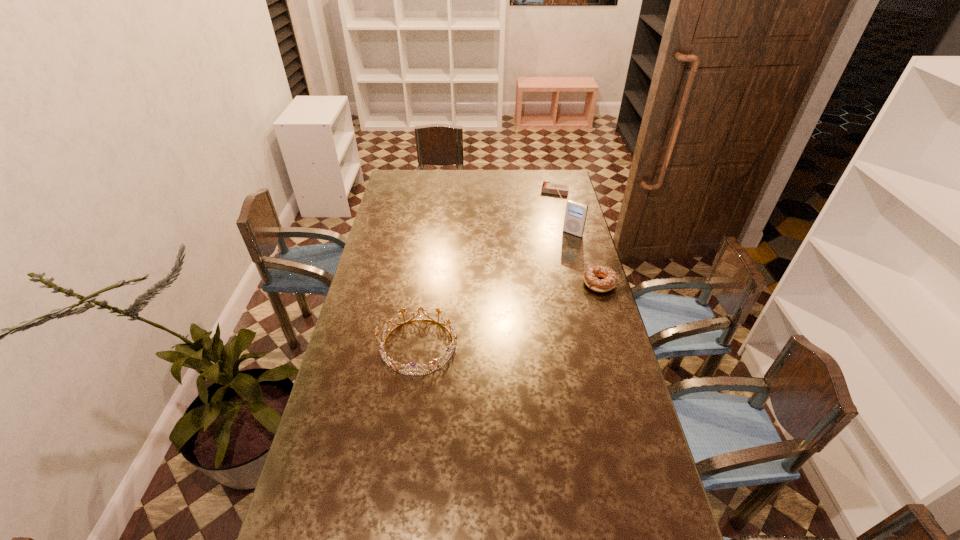
Where is `iPod that is at the right edge`? The width and height of the screenshot is (960, 540). iPod that is at the right edge is located at coordinates (575, 215).

Identify the location of matchbox situated at the right edge. (547, 187).

You are a GUI agent. You are given a task and a screenshot of the screen. Output one action in this format:
    pyautogui.click(x=<x>, y=<y>)
    Task: Click on the object that is positioned at the far right corner
    This screenshot has height=540, width=960.
    Given the screenshot: What is the action you would take?
    pyautogui.click(x=547, y=187)

In the image, there is a desktop. Where is `blank space at the far edge`? blank space at the far edge is located at coordinates tap(525, 170).

Where is `free region at the near edge`? This screenshot has width=960, height=540. free region at the near edge is located at coordinates [572, 538].

Image resolution: width=960 pixels, height=540 pixels. Identify the location of vacant space at the left edge of the desktop. (324, 454).

The image size is (960, 540). In the image, there is a desktop. Identify the location of vacant region at the right edge. (623, 489).

The image size is (960, 540). In the image, there is a desktop. What are the coordinates of `free space at the far left corner` in the screenshot? It's located at (413, 178).

This screenshot has height=540, width=960. Identify the location of unoccupied area between the second nearest object and the leftmost object. (509, 315).

The width and height of the screenshot is (960, 540). Find the location of `free space between the third farthest object and the third shortest object`. free space between the third farthest object and the third shortest object is located at coordinates (509, 315).